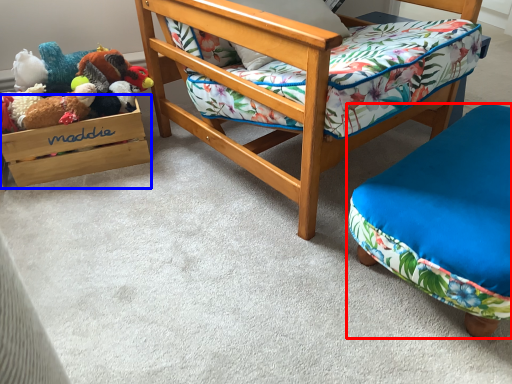
Question: Which object appears farthest to the camera in this image, furniture (highlighted by a red box) or storage box (highlighted by a blue box)?

Choices:
 (A) furniture
 (B) storage box

Answer: (B)